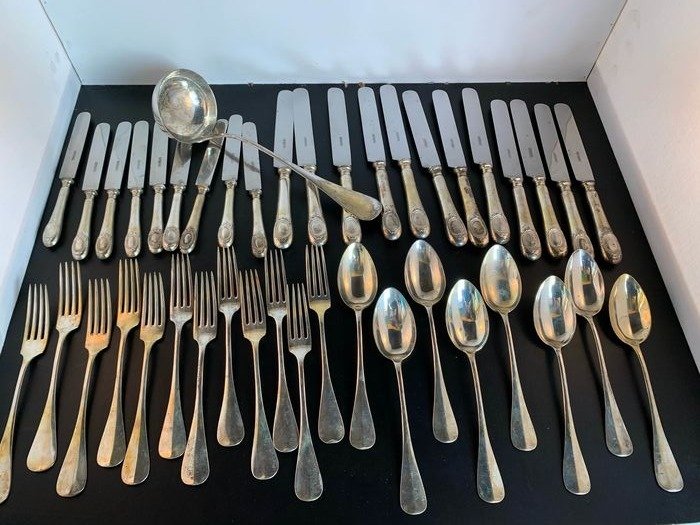
At what (x,y) coordinates should I click in order to perform the action: click on spoon handles. Please return your answer as a coordinate pair (x, y). Image resolution: width=700 pixels, height=525 pixels. Looking at the image, I should click on (678, 478), (620, 437), (574, 485), (522, 433), (491, 497), (446, 434), (414, 504), (357, 436).